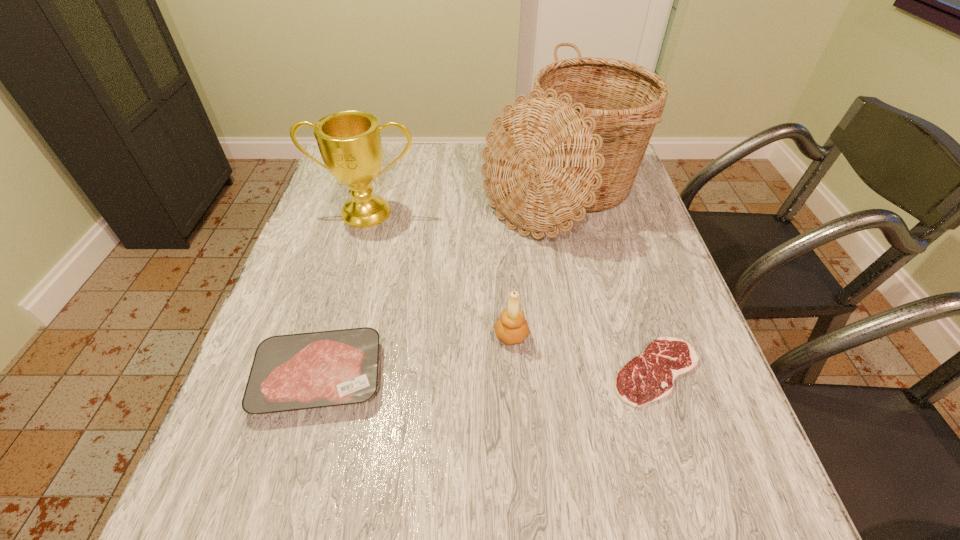
Find the location of a particular element. basket is located at coordinates [x=575, y=145].

The width and height of the screenshot is (960, 540). What are the coordinates of `the fourth shortest object` in the screenshot? It's located at (349, 142).

In order to click on the third tallest object in this screenshot , I will do `click(512, 328)`.

The width and height of the screenshot is (960, 540). I want to click on the left steak, so click(289, 372).

Where is `the second shortest object`? The image size is (960, 540). the second shortest object is located at coordinates (289, 372).

Locate an element on the screen. The width and height of the screenshot is (960, 540). the shortest object is located at coordinates (648, 377).

The width and height of the screenshot is (960, 540). Identify the location of the shorter steak. (648, 377).

Find the location of a particular element. Image resolution: width=960 pixels, height=540 pixels. vacant space situated 0.210m on the front of the basket is located at coordinates (587, 321).

Identify the location of free location located on the shiny surface of the award. (x=355, y=256).

At what (x,y) coordinates should I click in order to perform the action: click on free space located 0.090m on the right of the third tallest object. Please return your answer as a coordinate pair (x, y). This screenshot has height=540, width=960. Looking at the image, I should click on coord(572,335).